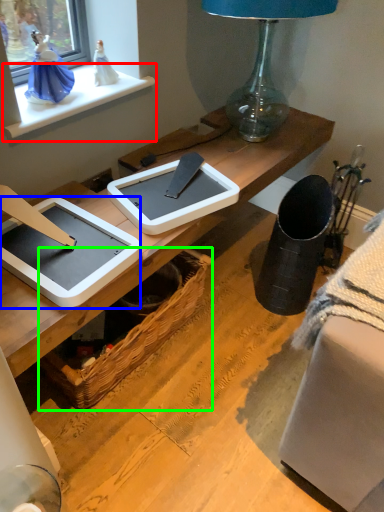
Question: Considering the real-world distances, which object is farthest from window sill (highlighted by a red box)? tablet computer (highlighted by a blue box) or picnic basket (highlighted by a green box)?

Choices:
 (A) tablet computer
 (B) picnic basket

Answer: (B)